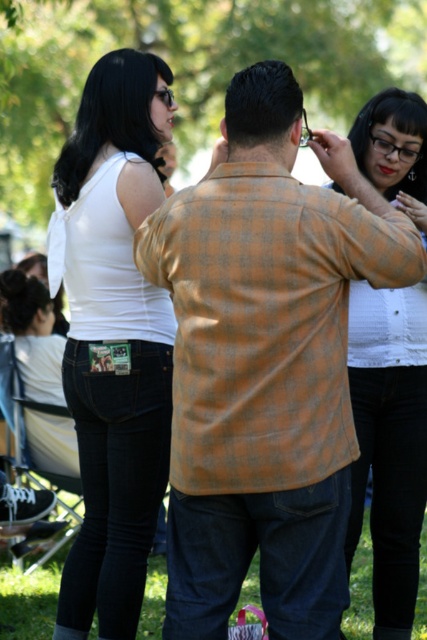
Is white matte tank top at upper left taller than matte white shirt at center?

Correct, white matte tank top at upper left is much taller as matte white shirt at center.

Is white matte tank top at upper left to the left of matte white shirt at center from the viewer's perspective?

Indeed, white matte tank top at upper left is positioned on the left side of matte white shirt at center.

Is point (66, 384) closer to camera compared to point (403, 541)?

Yes, point (66, 384) is in front of point (403, 541).

Find the location of a particular element. The width and height of the screenshot is (427, 640). white matte tank top at upper left is located at coordinates (114, 340).

Can you confirm if orange checkered shirt at center is shorter than matte white shirt at center?

Yes.

Is orange checkered shirt at center further to the viewer compared to matte white shirt at center?

No, orange checkered shirt at center is in front of matte white shirt at center.

I want to click on orange checkered shirt at center, so pyautogui.click(x=266, y=362).

Can you confirm if orange checkered shirt at center is positioned to the left of white matte tank top at upper left?

Incorrect, orange checkered shirt at center is not on the left side of white matte tank top at upper left.

Who is more distant from viewer, (338, 456) or (143, 522)?

The point (143, 522) is more distant.

Which is behind, point (404, 246) or point (105, 106)?

Point (105, 106)

Find the location of a particular element. This screenshot has width=427, height=640. orange checkered shirt at center is located at coordinates (266, 362).